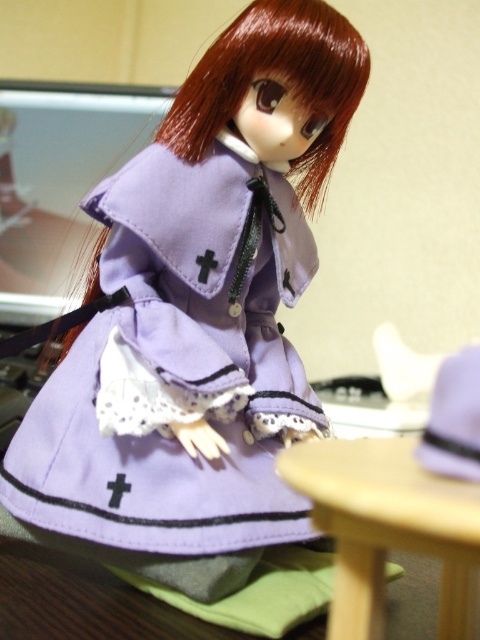
You are organizing a doll display and need to place both the light wood table at lower right and the purple fabric hat at right on a shelf. If the shelf has limited space, which object should you prioritize placing first to ensure both fit?

The light wood table at lower right is larger in size than the purple fabric hat at right, so you should prioritize placing the light wood table at lower right first to accommodate its larger size before placing the smaller purple fabric hat at right.

You are an interior designer assessing the doll display. The shiny red hair at center and the purple fabric hat at right are both part of the display. Which object takes up more visual space in the image?

The shiny red hair at center takes up more visual space because it is larger in size than the purple fabric hat at right.